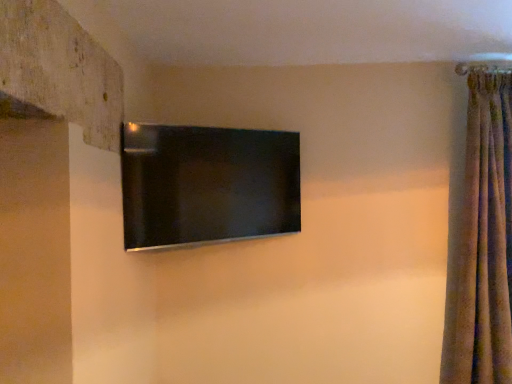
Question: Could you tell me if brown velvet curtain at right is turned towards matte black tv at center?

Choices:
 (A) no
 (B) yes

Answer: (A)

Question: Is brown velvet curtain at right turned away from matte black tv at center?

Choices:
 (A) yes
 (B) no

Answer: (B)

Question: From the image's perspective, is brown velvet curtain at right beneath matte black tv at center?

Choices:
 (A) yes
 (B) no

Answer: (A)

Question: Considering the relative sizes of brown velvet curtain at right and matte black tv at center in the image provided, is brown velvet curtain at right smaller than matte black tv at center?

Choices:
 (A) yes
 (B) no

Answer: (B)

Question: Does brown velvet curtain at right come behind matte black tv at center?

Choices:
 (A) no
 (B) yes

Answer: (B)

Question: From a real-world perspective, is brown velvet curtain at right below matte black tv at center?

Choices:
 (A) no
 (B) yes

Answer: (B)

Question: Can you confirm if matte black tv at center is positioned to the right of brown velvet curtain at right?

Choices:
 (A) no
 (B) yes

Answer: (A)

Question: Would you say matte black tv at center is outside brown velvet curtain at right?

Choices:
 (A) no
 (B) yes

Answer: (B)

Question: From a real-world perspective, is matte black tv at center positioned over brown velvet curtain at right based on gravity?

Choices:
 (A) yes
 (B) no

Answer: (A)

Question: Are matte black tv at center and brown velvet curtain at right beside each other?

Choices:
 (A) no
 (B) yes

Answer: (A)

Question: Considering the relative sizes of matte black tv at center and brown velvet curtain at right in the image provided, is matte black tv at center thinner than brown velvet curtain at right?

Choices:
 (A) yes
 (B) no

Answer: (A)

Question: From the image's perspective, is matte black tv at center located beneath brown velvet curtain at right?

Choices:
 (A) yes
 (B) no

Answer: (B)

Question: Based on their positions, is matte black tv at center located to the left or right of brown velvet curtain at right?

Choices:
 (A) left
 (B) right

Answer: (A)